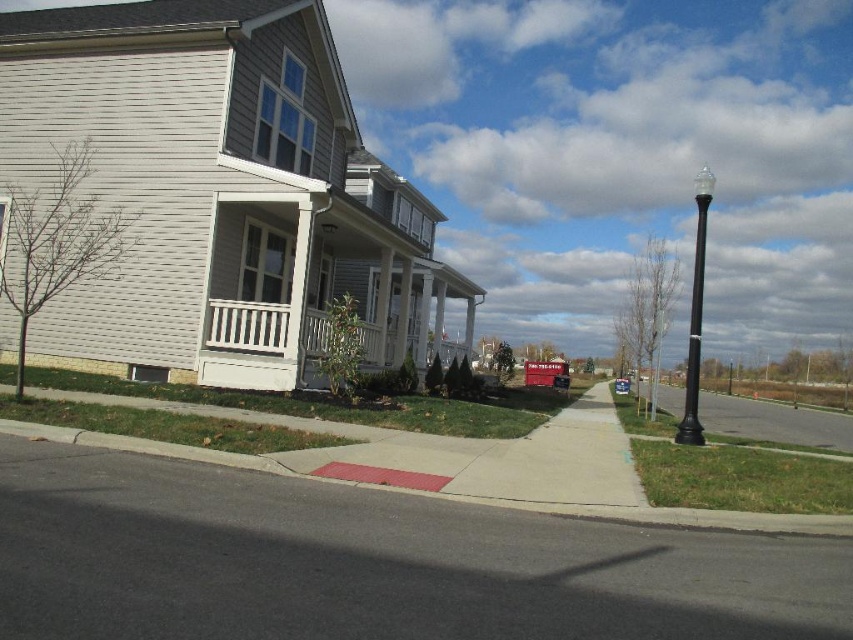
You are a delivery person approaching the house. You need to park your vehicle on the black asphalt at lower left but must avoid the metallic silver sedan at center. Can you safely park there without moving the sedan?

The black asphalt at lower left is closer to the viewer than the metallic silver sedan at center, so there is space between them. You can safely park on the black asphalt at lower left without moving the sedan.

You are a delivery person approaching the house and see the black asphalt at lower left and the black polished metal streetlight at right. Which object is closer to the front door of the house?

The black asphalt at lower left is closer to the front door of the house because it is positioned below the black polished metal streetlight at right, indicating it is in a lower, more forward position relative to the streetlight.

You are a delivery person approaching the house from the sidewalk. You need to place a package on the white painted wood porch at center and then proceed to the black polished metal streetlight at right. Which object should you interact with first?

You should place the package on the white painted wood porch at center first because the black polished metal streetlight at right is located behind it, making the porch more accessible from the sidewalk.